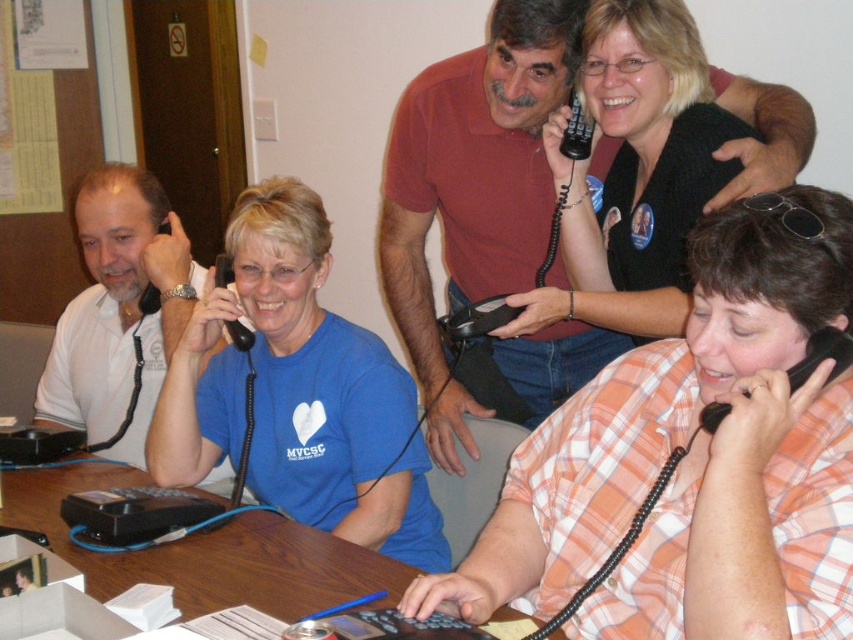
You are standing at the entrance of the room and see two points marked in the image. Which point is closer to you, point (827, 570) or point (483, 396)?

Point (827, 570) is in front of point (483, 396), so it is closer to you.

You are standing in the room and see the brown wooden table at center and the white matte shirt at left. Which object is positioned to the right of the other?

The brown wooden table at center is to the right of the white matte shirt at left.

You are standing in the office and need to locate both the orange plaid shirt at lower right and the matte red shirt at upper center. Which one is positioned lower in the image?

The orange plaid shirt at lower right is positioned lower in the image than the matte red shirt at upper center.